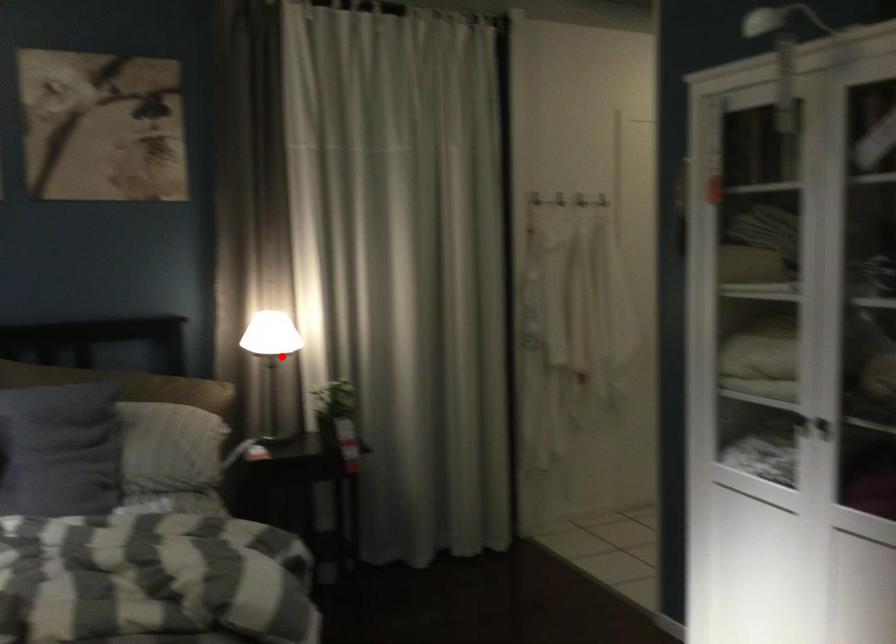
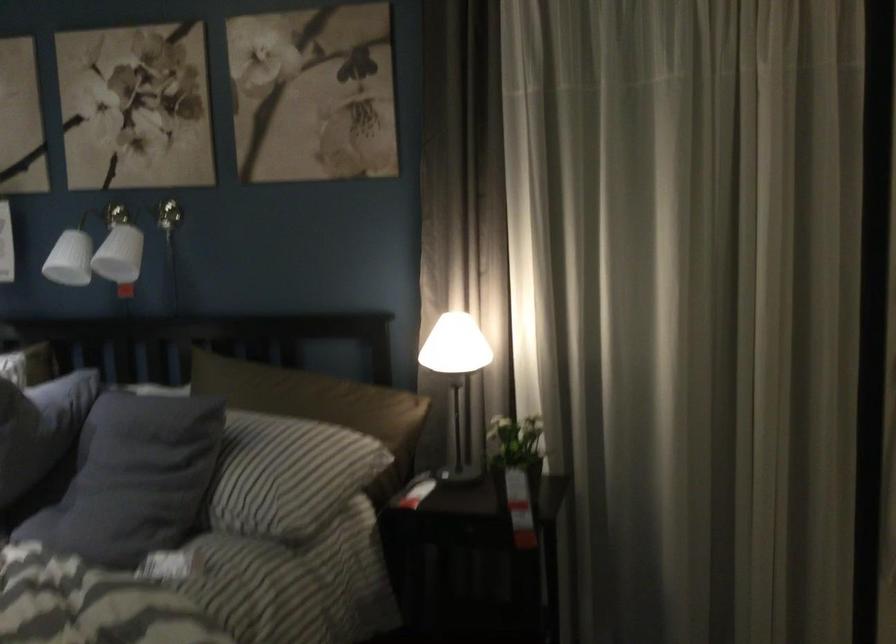
The point at the highlighted location is marked in the first image. Where is the corresponding point in the second image?

(455, 375)